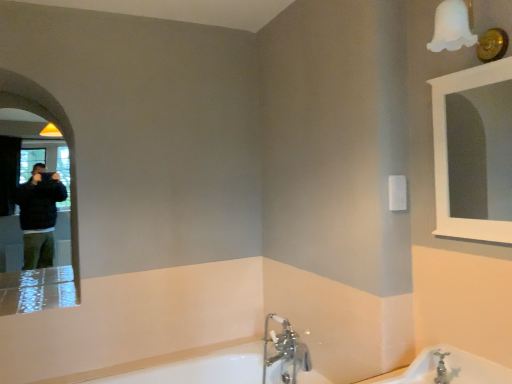
Question: Which is correct: white frosted glass light fixture at upper right is inside matte black mirror at left, acting as the 2th mirror starting from the right, or outside of it?

Choices:
 (A) outside
 (B) inside

Answer: (A)

Question: Based on their positions, is white frosted glass light fixture at upper right located to the left or right of matte black mirror at left, the first mirror when ordered from left to right?

Choices:
 (A) left
 (B) right

Answer: (B)

Question: Estimate the real-world distances between objects in this image. Which object is farther from the white frosted glass light fixture at upper right?

Choices:
 (A) white glossy bathtub at lower center, positioned as the second bath in right-to-left order
 (B) white porcelain bathtub at lower right, arranged as the 2th bath when viewed from the left
 (C) white glossy mirror at upper right, arranged as the 1th mirror when viewed from the right
 (D) chrome metallic faucet at lower center
 (E) matte black mirror at left, acting as the 2th mirror starting from the right

Answer: (C)

Question: Which is farther from the white frosted glass light fixture at upper right?

Choices:
 (A) matte black mirror at left, the first mirror when ordered from left to right
 (B) white glossy bathtub at lower center, the 2th bath from the top
 (C) white porcelain bathtub at lower right, the 2th bath in the bottom-to-top sequence
 (D) chrome metallic faucet at lower center
 (E) white glossy mirror at upper right, marked as the second mirror in a left-to-right arrangement

Answer: (E)